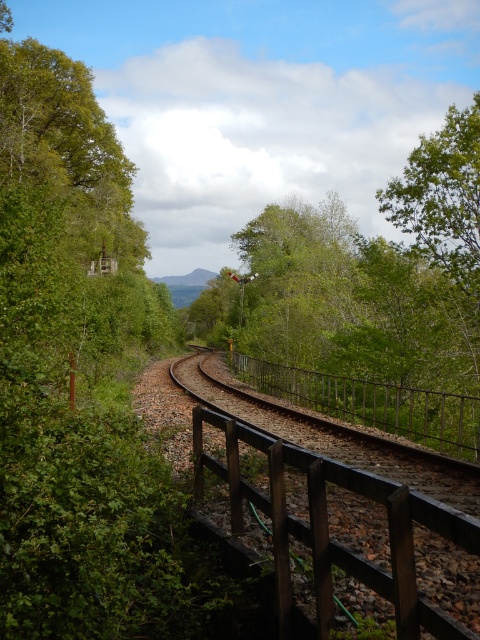
Between brown wooden fence at center and black metal rail at center, which one is positioned higher?

brown wooden fence at center

Does brown wooden fence at center have a lesser width compared to black metal rail at center?

Yes.

Which is behind, point (334, 547) or point (459, 410)?

Positioned behind is point (459, 410).

At what (x,y) coordinates should I click in order to perform the action: click on brown wooden fence at center. Please return your answer as a coordinate pair (x, y). Image resolution: width=480 pixels, height=640 pixels. Looking at the image, I should click on coord(327,529).